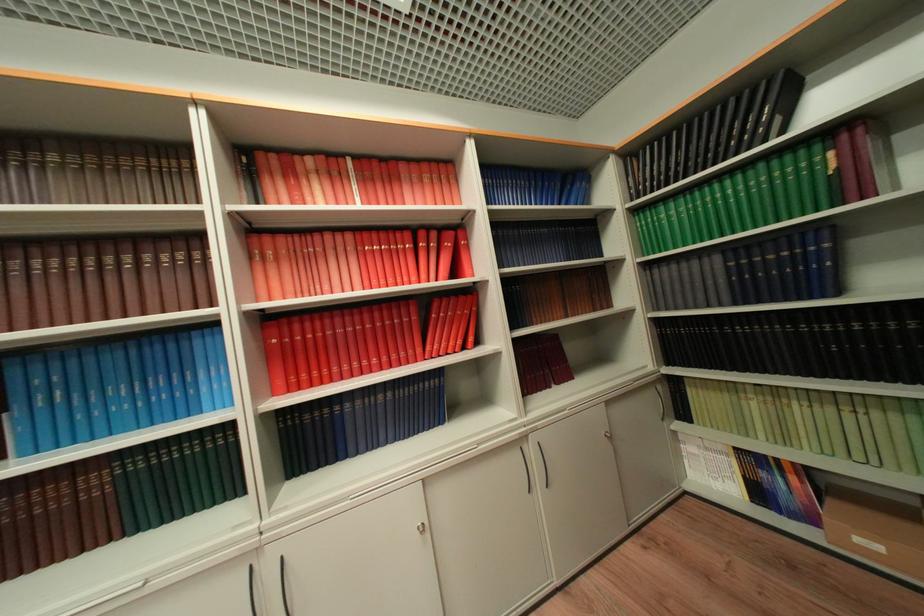
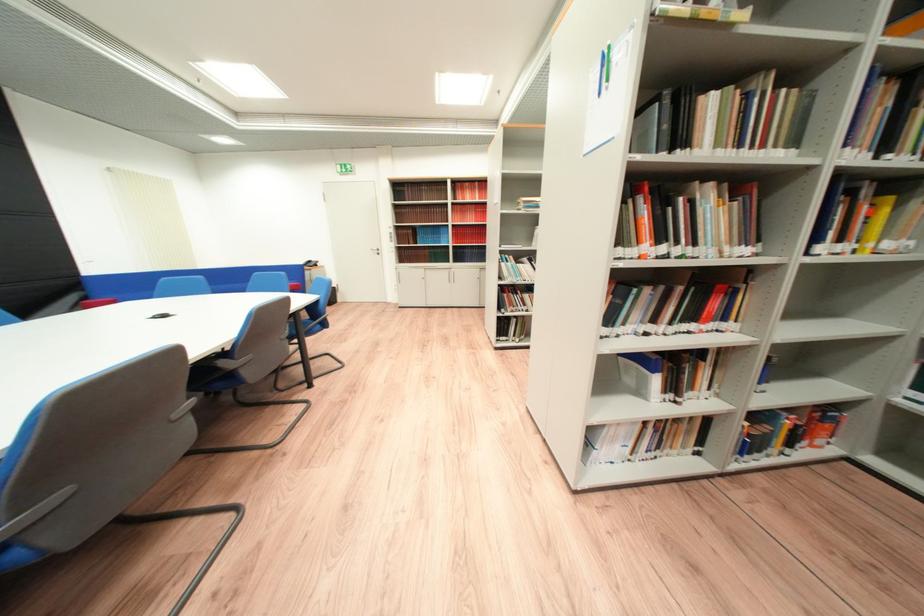
Question: I am providing you with two images of the same scene from different viewpoints. Which of the following objects are not visible in image2?

Choices:
 (A) air freshener lever
 (B) cabinet door handle
 (C) black book
 (D) blue chair sitting surface

Answer: (C)